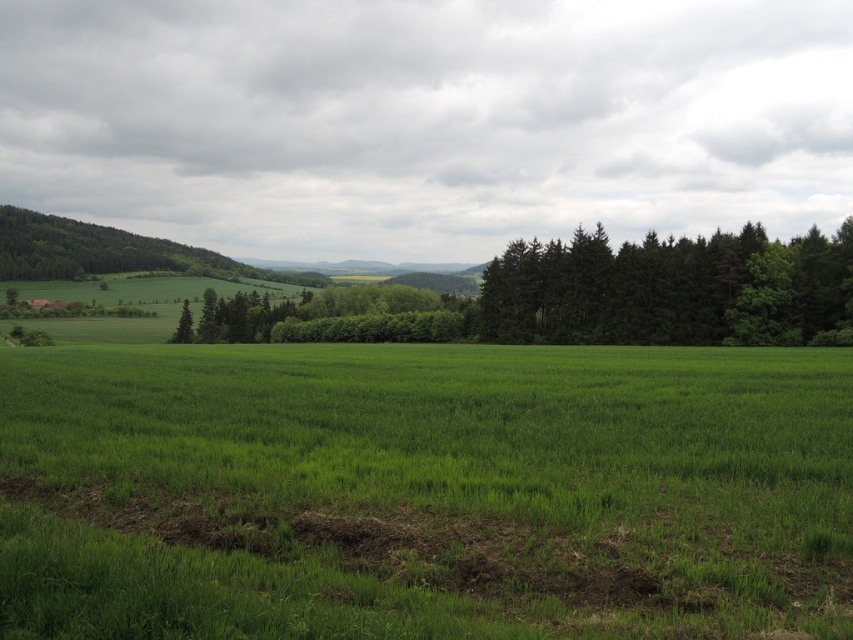
Who is more forward, (558,257) or (68,259)?

Positioned in front is point (558,257).

You are a GUI agent. You are given a task and a screenshot of the screen. Output one action in this format:
    pyautogui.click(x=<x>, y=<y>)
    Task: Click on the green matte forest at right
    
    Given the screenshot: What is the action you would take?
    pyautogui.click(x=668, y=289)

The height and width of the screenshot is (640, 853). I want to click on green matte forest at right, so click(668, 289).

Is green grassy field at center wider than green matte forest at right?

Correct, the width of green grassy field at center exceeds that of green matte forest at right.

Who is more forward, (67, 480) or (850, 257)?

Point (67, 480) is more forward.

The image size is (853, 640). I want to click on green grassy field at center, so click(x=424, y=492).

Between green grassy field at center and green leafy forest at left, which one appears on the left side from the viewer's perspective?

green leafy forest at left is more to the left.

Can you confirm if green grassy field at center is positioned below green leafy forest at left?

Yes.

Who is more forward, [184,429] or [9,275]?

Point [184,429]

Locate an element on the screen. green grassy field at center is located at coordinates (424, 492).